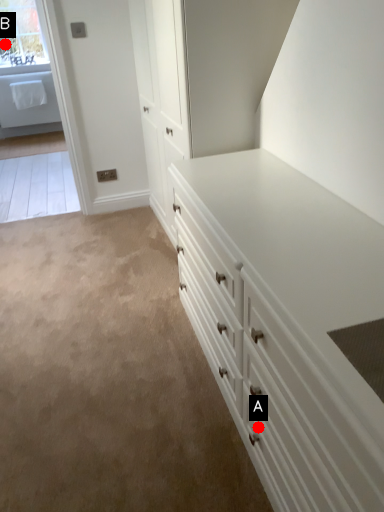
Question: Two points are circled on the image, labeled by A and B beside each circle. Which of the following is the farthest from the observer?

Choices:
 (A) A is further
 (B) B is further

Answer: (B)